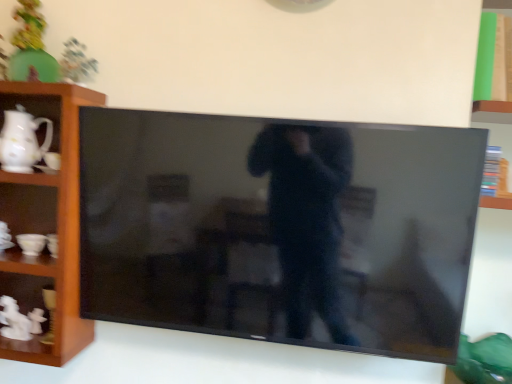
Question: Can you confirm if white glossy pitcher at left is wider than wooden shelf at left?

Choices:
 (A) yes
 (B) no

Answer: (B)

Question: Does white glossy pitcher at left have a lesser height compared to wooden shelf at left?

Choices:
 (A) no
 (B) yes

Answer: (B)

Question: Is white glossy pitcher at left to the left of wooden shelf at left from the viewer's perspective?

Choices:
 (A) no
 (B) yes

Answer: (B)

Question: From the image's perspective, does white glossy pitcher at left appear lower than wooden shelf at left?

Choices:
 (A) no
 (B) yes

Answer: (A)

Question: Considering the relative sizes of white glossy pitcher at left and wooden shelf at left in the image provided, is white glossy pitcher at left thinner than wooden shelf at left?

Choices:
 (A) yes
 (B) no

Answer: (A)

Question: Considering the relative sizes of white glossy pitcher at left and wooden shelf at left in the image provided, is white glossy pitcher at left taller than wooden shelf at left?

Choices:
 (A) yes
 (B) no

Answer: (B)

Question: Is black glossy tv at center wider than matte green toy at upper left?

Choices:
 (A) yes
 (B) no

Answer: (A)

Question: Is black glossy tv at center beside matte green toy at upper left?

Choices:
 (A) yes
 (B) no

Answer: (B)

Question: Can we say black glossy tv at center lies outside matte green toy at upper left?

Choices:
 (A) no
 (B) yes

Answer: (B)

Question: From the image's perspective, is black glossy tv at center on matte green toy at upper left?

Choices:
 (A) yes
 (B) no

Answer: (B)

Question: Is black glossy tv at center smaller than matte green toy at upper left?

Choices:
 (A) no
 (B) yes

Answer: (A)

Question: Can you confirm if black glossy tv at center is thinner than matte green toy at upper left?

Choices:
 (A) no
 (B) yes

Answer: (A)

Question: Is wooden shelf at left not close to matte green toy at upper left?

Choices:
 (A) yes
 (B) no

Answer: (B)